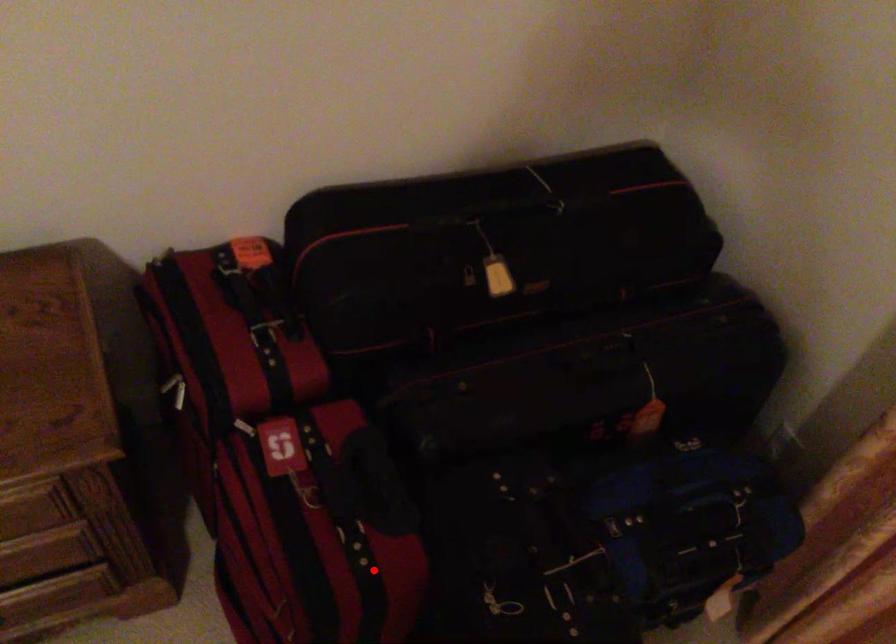
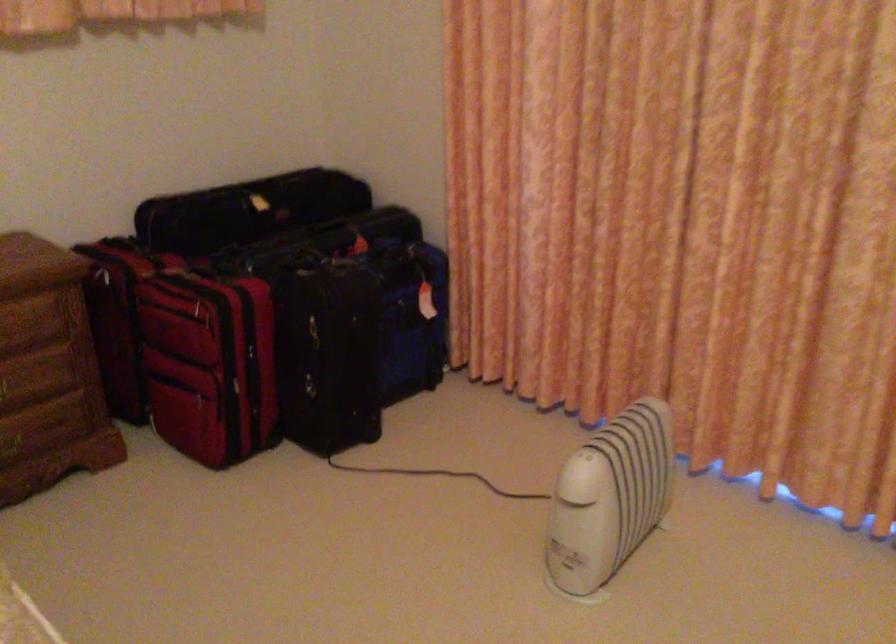
Question: I am providing you with two images of the same scene from different viewpoints. A red point is marked on the first image. Is the red point's position out of view in image 2?

Choices:
 (A) Yes
 (B) No

Answer: (B)